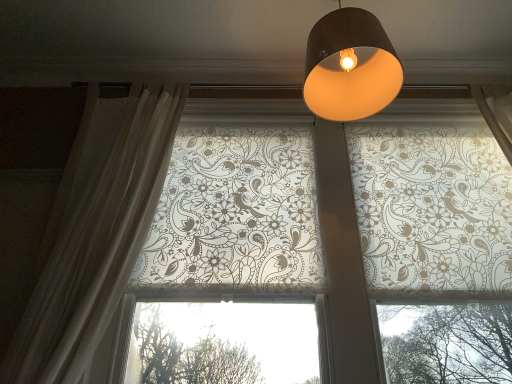
Question: From the image's perspective, would you say matte black lampshade at upper center is shown under sheer white curtain at left?

Choices:
 (A) no
 (B) yes

Answer: (A)

Question: Does matte black lampshade at upper center come behind sheer white curtain at left?

Choices:
 (A) yes
 (B) no

Answer: (A)

Question: Can you confirm if matte black lampshade at upper center is bigger than sheer white curtain at left?

Choices:
 (A) no
 (B) yes

Answer: (A)

Question: Considering the relative sizes of matte black lampshade at upper center and sheer white curtain at left in the image provided, is matte black lampshade at upper center wider than sheer white curtain at left?

Choices:
 (A) no
 (B) yes

Answer: (B)

Question: Does matte black lampshade at upper center appear on the left side of sheer white curtain at left?

Choices:
 (A) no
 (B) yes

Answer: (A)

Question: Looking at their shapes, would you say translucent floral-patterned roller blinds at upper center is wider or thinner than matte black lampshade at upper center?

Choices:
 (A) wide
 (B) thin

Answer: (B)

Question: Choose the correct answer: Is translucent floral-patterned roller blinds at upper center inside matte black lampshade at upper center or outside it?

Choices:
 (A) inside
 (B) outside

Answer: (B)

Question: Considering their positions, is translucent floral-patterned roller blinds at upper center located in front of or behind matte black lampshade at upper center?

Choices:
 (A) behind
 (B) front

Answer: (A)

Question: From the image's perspective, is translucent floral-patterned roller blinds at upper center located above or below matte black lampshade at upper center?

Choices:
 (A) below
 (B) above

Answer: (A)

Question: In the image, is matte black lampshade at upper center positioned in front of or behind translucent floral-patterned roller blinds at upper center?

Choices:
 (A) behind
 (B) front

Answer: (B)

Question: Is point (351, 8) positioned closer to the camera than point (238, 198)?

Choices:
 (A) closer
 (B) farther

Answer: (A)

Question: Would you say matte black lampshade at upper center is to the left or to the right of translucent floral-patterned roller blinds at upper center in the picture?

Choices:
 (A) right
 (B) left

Answer: (B)

Question: From a real-world perspective, is matte black lampshade at upper center above or below translucent floral-patterned roller blinds at upper center?

Choices:
 (A) above
 (B) below

Answer: (A)

Question: Relative to translucent floral-patterned roller blinds at upper center, is sheer white curtain at left in front or behind?

Choices:
 (A) behind
 (B) front

Answer: (B)

Question: Is point (69, 248) positioned closer to the camera than point (267, 193)?

Choices:
 (A) closer
 (B) farther

Answer: (A)